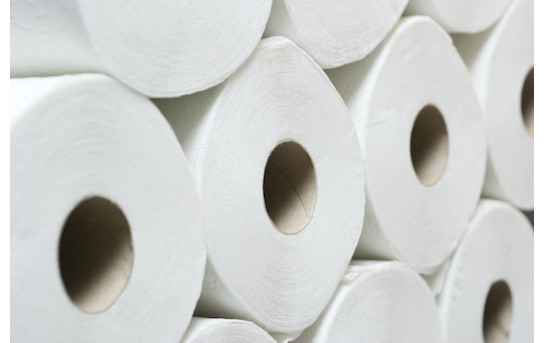
Locate an element on the screen. rolls of toilet paper is located at coordinates [142, 161], [156, 43], [271, 103], [334, 32], [429, 85], [468, 14], [510, 110], [517, 242], [372, 300], [244, 333].